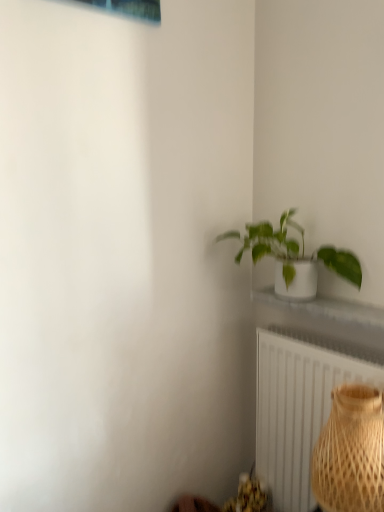
Question: From a real-world perspective, is green glossy plant at upper right above or below white textured radiator at lower right?

Choices:
 (A) below
 (B) above

Answer: (B)

Question: Visually, is green glossy plant at upper right positioned to the left or to the right of white textured radiator at lower right?

Choices:
 (A) right
 (B) left

Answer: (B)

Question: Considering the real-world distances, which object is farthest from the white textured radiator at lower right?

Choices:
 (A) green glossy plant at upper right
 (B) bamboo textured vase at lower right

Answer: (A)

Question: Which object is the closest to the bamboo textured vase at lower right?

Choices:
 (A) white textured radiator at lower right
 (B) green glossy plant at upper right

Answer: (A)